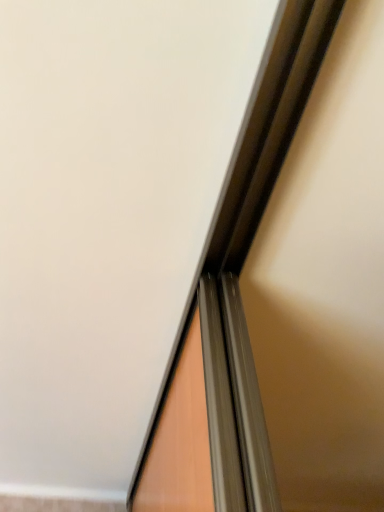
The image size is (384, 512). What do you see at coordinates (232, 309) in the screenshot?
I see `metallic frame at upper right` at bounding box center [232, 309].

Locate an element on the screen. The image size is (384, 512). metallic frame at upper right is located at coordinates (232, 309).

Measure the distance between point (201, 504) and camera.

They are 23.70 inches apart.

Where is `metallic frame at upper right`? metallic frame at upper right is located at coordinates (232, 309).